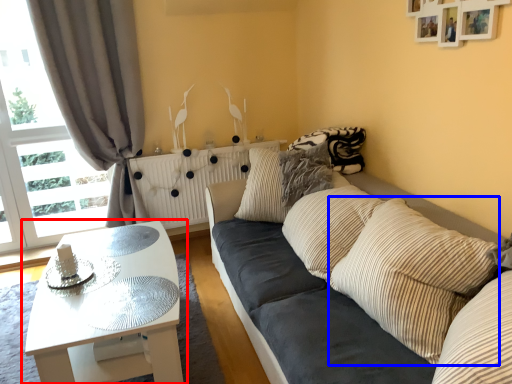
Question: Which object appears closest to the camera in this image, coffee table (highlighted by a red box) or pillow (highlighted by a blue box)?

Choices:
 (A) coffee table
 (B) pillow

Answer: (B)